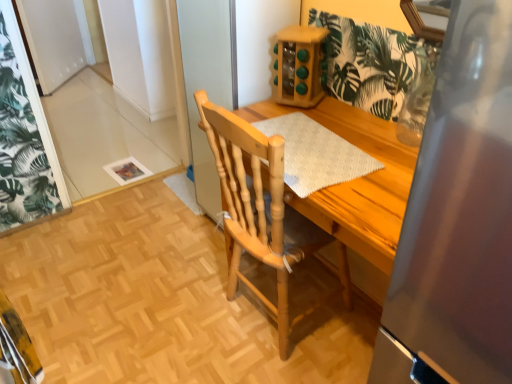
Question: Does white textured placemat at center appear on the right side of natural wood chair at center?

Choices:
 (A) yes
 (B) no

Answer: (A)

Question: Considering the relative positions of white textured placemat at center and natural wood chair at center in the image provided, is white textured placemat at center to the left of natural wood chair at center from the viewer's perspective?

Choices:
 (A) no
 (B) yes

Answer: (A)

Question: Is white textured placemat at center in contact with natural wood chair at center?

Choices:
 (A) no
 (B) yes

Answer: (A)

Question: Can you confirm if white textured placemat at center is bigger than natural wood chair at center?

Choices:
 (A) no
 (B) yes

Answer: (A)

Question: Is white textured placemat at center looking in the opposite direction of natural wood chair at center?

Choices:
 (A) yes
 (B) no

Answer: (A)

Question: Is white textured placemat at center surrounding natural wood chair at center?

Choices:
 (A) no
 (B) yes

Answer: (A)

Question: From a real-world perspective, does natural wood chair at center sit lower than white textured placemat at center?

Choices:
 (A) no
 (B) yes

Answer: (B)

Question: From the image's perspective, would you say natural wood chair at center is positioned over white textured placemat at center?

Choices:
 (A) no
 (B) yes

Answer: (A)

Question: Considering the relative sizes of natural wood chair at center and white textured placemat at center in the image provided, is natural wood chair at center wider than white textured placemat at center?

Choices:
 (A) yes
 (B) no

Answer: (A)

Question: Is natural wood chair at center in contact with white textured placemat at center?

Choices:
 (A) yes
 (B) no

Answer: (B)

Question: Can you confirm if natural wood chair at center is positioned to the right of white textured placemat at center?

Choices:
 (A) yes
 (B) no

Answer: (B)

Question: Does natural wood chair at center have a lesser width compared to white textured placemat at center?

Choices:
 (A) yes
 (B) no

Answer: (B)

Question: In terms of height, does white textured placemat at center look taller or shorter compared to natural wood chair at center?

Choices:
 (A) tall
 (B) short

Answer: (B)